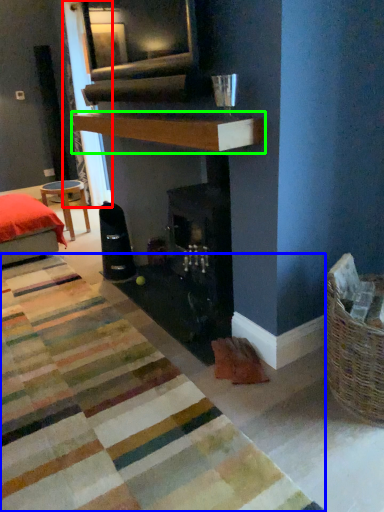
Question: Considering the real-world distances, which object is farthest from curtain (highlighted by a red box)? mat (highlighted by a blue box) or mantle (highlighted by a green box)?

Choices:
 (A) mat
 (B) mantle

Answer: (A)